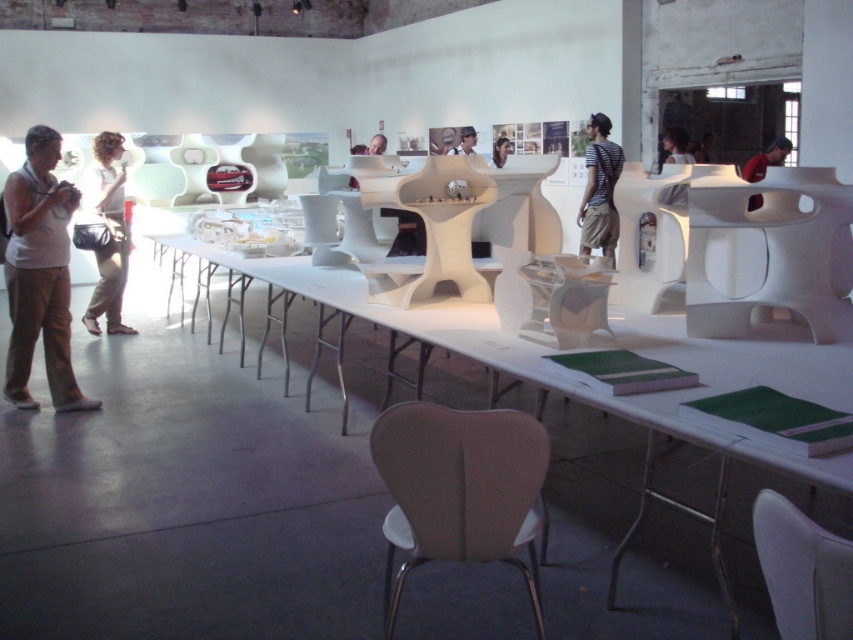
Does point (36, 204) lie in front of point (677, 129)?

Yes, point (36, 204) is in front of point (677, 129).

Which of these two, white cotton tank top at left or matte black hair at upper center, stands taller?

white cotton tank top at left

Image resolution: width=853 pixels, height=640 pixels. Find the location of `white cotton tank top at left`. white cotton tank top at left is located at coordinates (39, 273).

Does white plastic table at center have a greater height compared to smooth white hair at center?

Correct, white plastic table at center is much taller as smooth white hair at center.

Who is positioned more to the right, white plastic table at center or smooth white hair at center?

smooth white hair at center

Which is behind, point (461, 316) or point (509, 141)?

The point (509, 141) is more distant.

Locate an element on the screen. The height and width of the screenshot is (640, 853). white plastic table at center is located at coordinates (579, 385).

Describe the element at coordinates (766, 160) in the screenshot. I see `red fabric shirt at upper right` at that location.

Is red fabric shirt at upper right in front of smooth white hair at center?

Yes, red fabric shirt at upper right is in front of smooth white hair at center.

Is point (784, 145) closer to camera compared to point (508, 154)?

Yes, point (784, 145) is in front of point (508, 154).

Where is `red fabric shirt at upper right`? This screenshot has width=853, height=640. red fabric shirt at upper right is located at coordinates (766, 160).